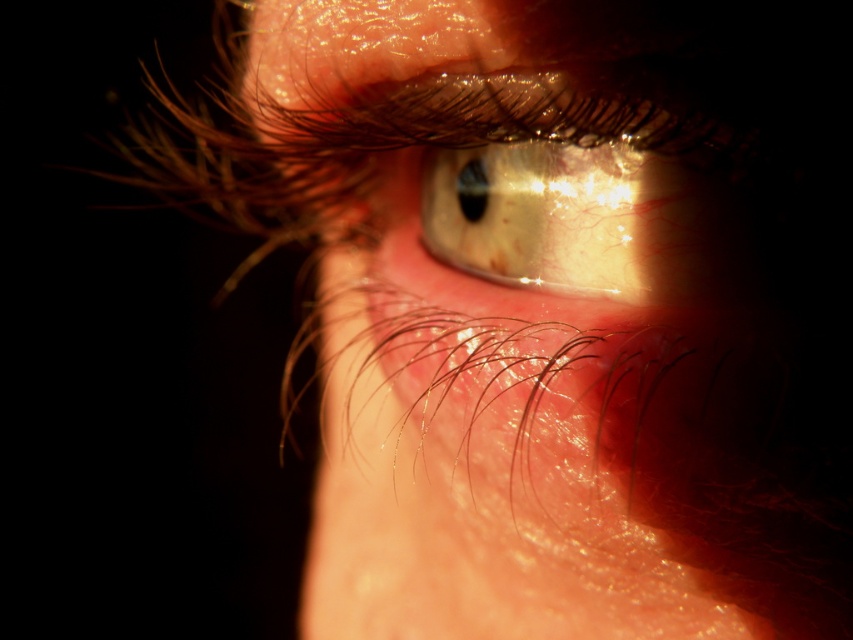
Based on the scene description, where is the smooth skin eye at center located in terms of its 2D coordinates?

The smooth skin eye at center is located at the 2D coordinates point (563, 420).

You are a photographer taking a closeup of an eye. You notice two points in the image labeled as point (x=444, y=602) and point (x=605, y=180). Which point is closer to the camera?

Point (x=444, y=602) is further to the camera than point (x=605, y=180). Therefore, point (x=605, y=180) is closer to the camera.

Based on the scene description, which object is wider, the smooth skin eye at center or the shiny gold eye at center?

The smooth skin eye at center is wider than the shiny gold eye at center according to the description.